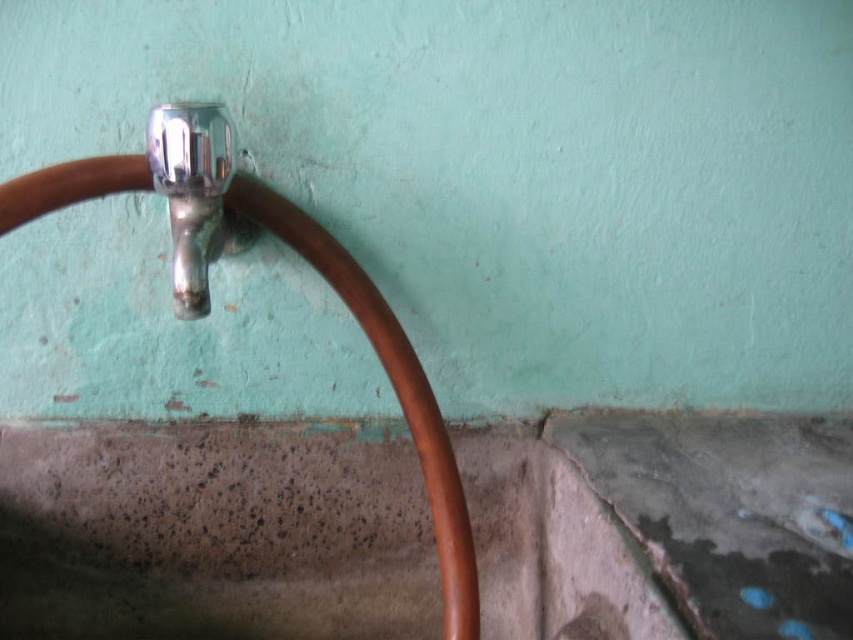
Question: Can you confirm if shiny copper hose at upper left is thinner than polished chrome faucet at upper left?

Choices:
 (A) no
 (B) yes

Answer: (A)

Question: Considering the relative positions of shiny copper hose at upper left and polished chrome faucet at upper left in the image provided, where is shiny copper hose at upper left located with respect to polished chrome faucet at upper left?

Choices:
 (A) below
 (B) above

Answer: (A)

Question: Which of the following is the closest to the observer?

Choices:
 (A) polished chrome faucet at upper left
 (B) shiny copper hose at upper left

Answer: (A)

Question: Which object appears farthest from the camera in this image?

Choices:
 (A) shiny copper hose at upper left
 (B) polished chrome faucet at upper left

Answer: (A)

Question: Is shiny copper hose at upper left to the right of polished chrome faucet at upper left from the viewer's perspective?

Choices:
 (A) no
 (B) yes

Answer: (B)